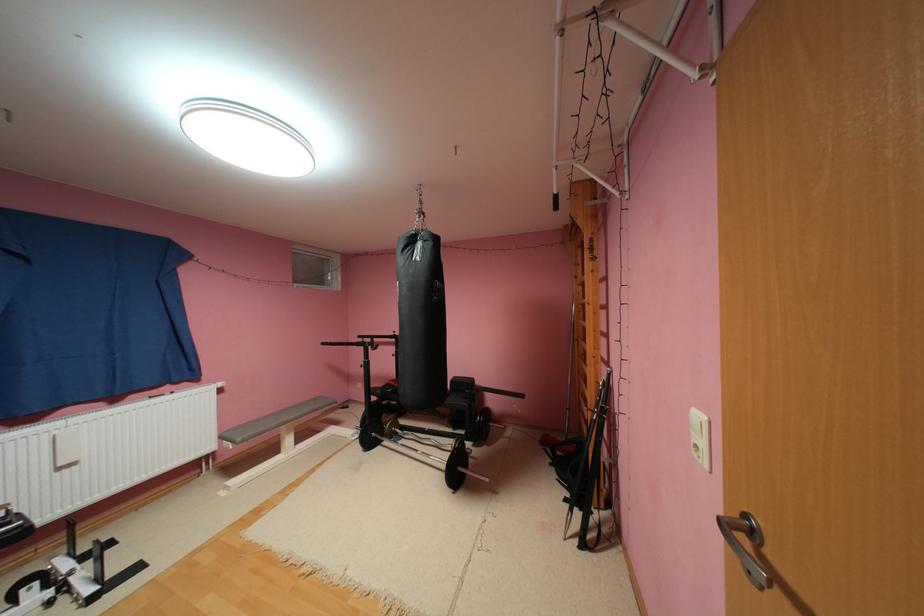
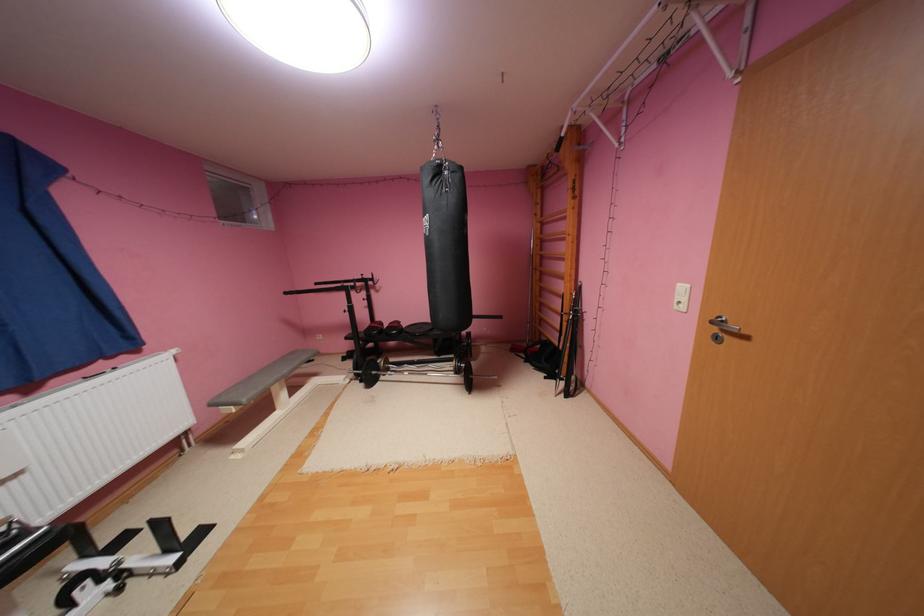
Where in the second image is the point corresponding to (x=606, y=383) from the first image?

(580, 294)